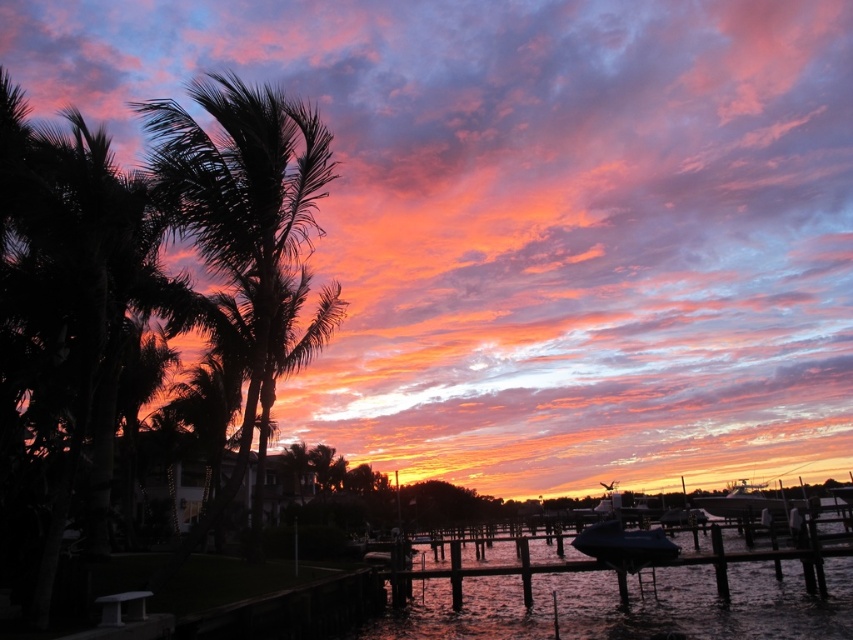
Question: Which object is closer to the camera taking this photo?

Choices:
 (A) blue tarpaulin boat at lower right
 (B) silky black palm tree at left
 (C) glossy water at dock center
 (D) dark green leafy palm tree at left

Answer: (D)

Question: Does glossy water at dock center appear over blue tarpaulin boat at lower right?

Choices:
 (A) no
 (B) yes

Answer: (A)

Question: Can you confirm if blue tarpaulin boat at lower right is thinner than shiny blue boat at lower right?

Choices:
 (A) yes
 (B) no

Answer: (A)

Question: Which object is the farthest from the dark green leafy palm tree at left?

Choices:
 (A) shiny blue boat at lower right
 (B) glossy water at dock center

Answer: (A)

Question: Which object is closer to the camera taking this photo?

Choices:
 (A) shiny blue boat at lower right
 (B) silky black palm tree at left

Answer: (B)

Question: Can you confirm if dark green leafy palm tree at left is wider than glossy water at dock center?

Choices:
 (A) yes
 (B) no

Answer: (B)